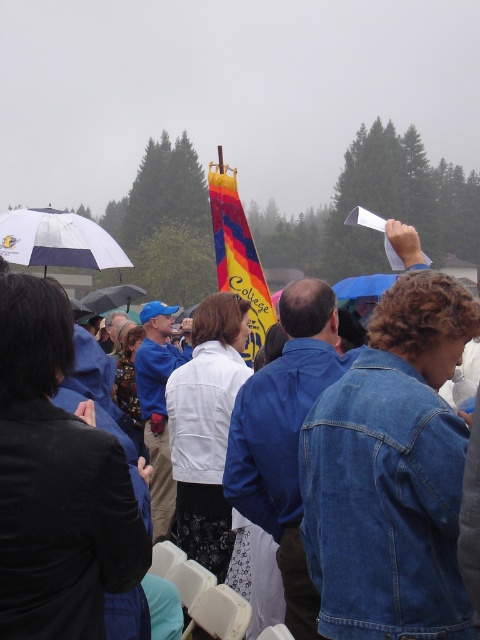
Question: Is whiteumbrella at upper left wider than rainbow fabric flag at center?

Choices:
 (A) yes
 (B) no

Answer: (A)

Question: Estimate the real-world distances between objects in this image. Which object is farther from the rainbow fabric flag at center?

Choices:
 (A) denim jacket at lower right
 (B) whiteumbrella at upper left

Answer: (A)

Question: From the image, what is the correct spatial relationship of denim jacket at lower right in relation to rainbow fabric flag at center?

Choices:
 (A) right
 (B) left

Answer: (A)

Question: Which point is farther to the camera?

Choices:
 (A) (49, 260)
 (B) (116, 292)
 (C) (236, 285)
 (D) (409, 570)

Answer: (B)

Question: Can you confirm if whiteumbrella at upper left is positioned to the right of rainbow fabric flag at center?

Choices:
 (A) no
 (B) yes

Answer: (A)

Question: Which point is closer to the camera?

Choices:
 (A) denim jacket at lower right
 (B) whiteumbrella at upper left
 (C) rainbow fabric flag at center
 (D) black matte umbrella at center

Answer: (A)